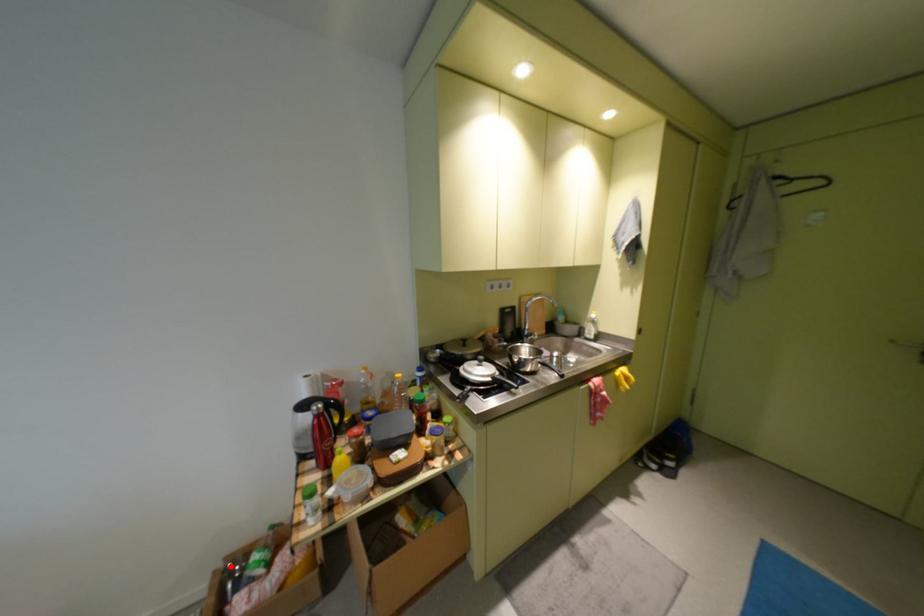
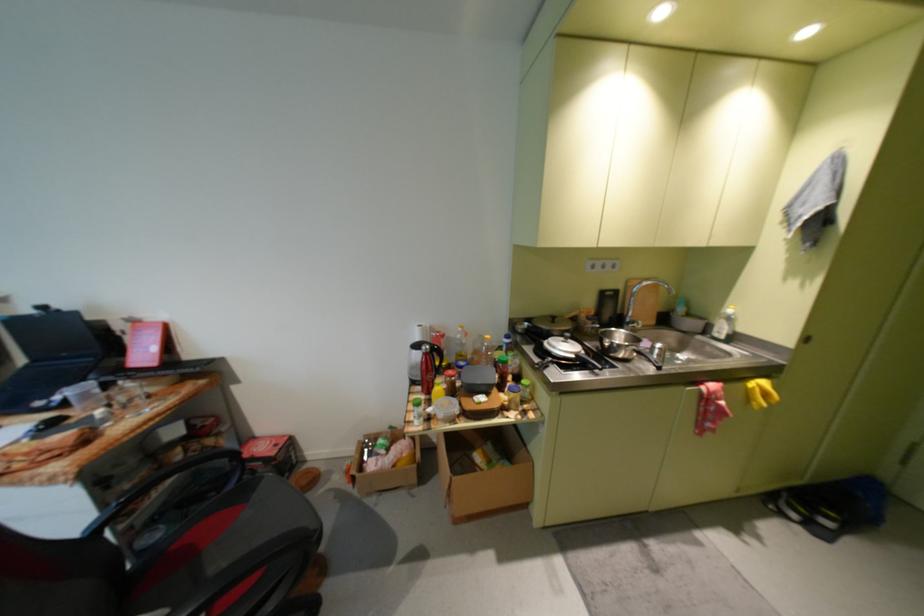
Find the pixel in the second image that matches the highlighted location in the first image.

(372, 440)